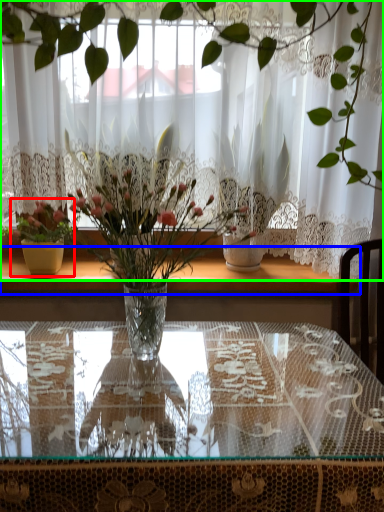
Question: Based on their relative distances, which object is farther from houseplant (highlighted by a red box)? Choose from window sill (highlighted by a blue box) and curtain (highlighted by a green box).

Choices:
 (A) window sill
 (B) curtain

Answer: (B)